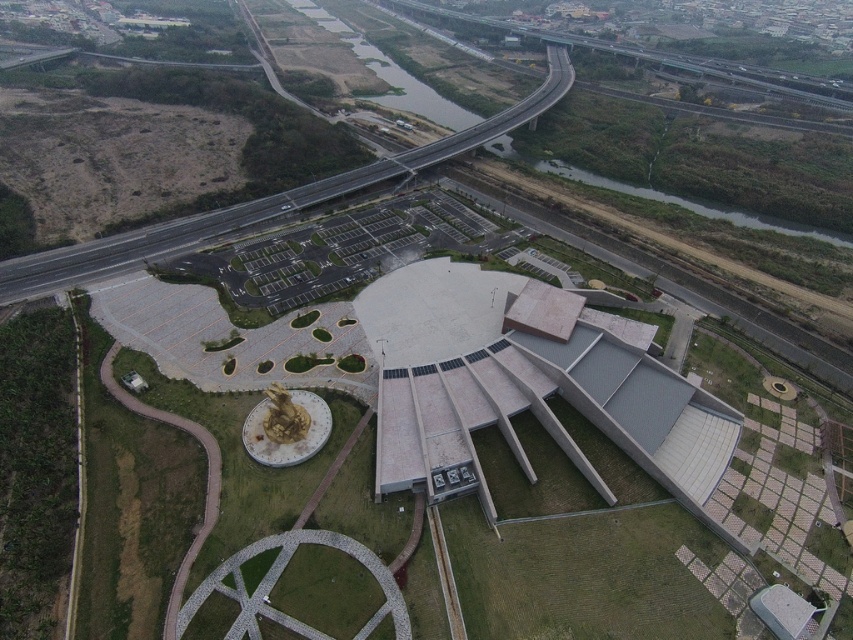
You are a visitor approaching the white concrete building at center and the asphalt road at upper center from the north. Which one would you see first as you move closer?

The asphalt road at upper center would be seen first because the white concrete building at center is located to the right of it, meaning the road is closer to the north approach.